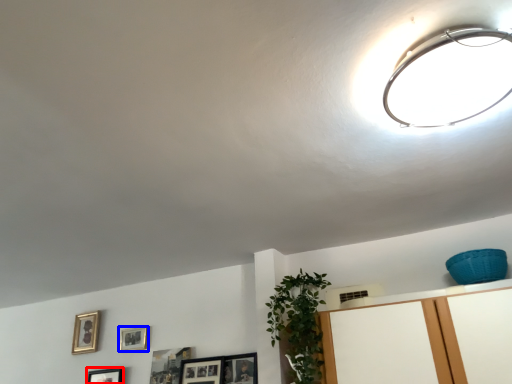
Question: Which point is closer to the camera, picture frame (highlighted by a red box) or picture frame (highlighted by a blue box)?

Choices:
 (A) picture frame
 (B) picture frame

Answer: (A)